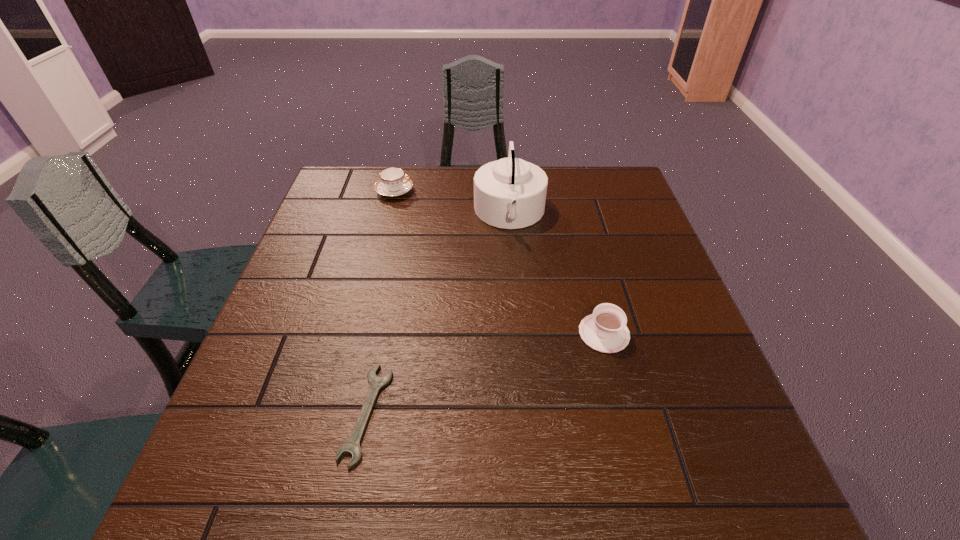
The height and width of the screenshot is (540, 960). I want to click on the tallest object, so click(x=510, y=193).

At what (x,y) coordinates should I click in order to perform the action: click on the third object from left to right. Please return your answer as a coordinate pair (x, y). This screenshot has width=960, height=540. Looking at the image, I should click on (510, 193).

Find the location of a particular element. the left teacup is located at coordinates (393, 182).

The height and width of the screenshot is (540, 960). What are the coordinates of `the right teacup` in the screenshot? It's located at (605, 330).

Where is `the nearer teacup`? Image resolution: width=960 pixels, height=540 pixels. the nearer teacup is located at coordinates (605, 330).

Where is `the shortest object`? the shortest object is located at coordinates (352, 446).

In order to click on the nearest object in this screenshot , I will do `click(352, 446)`.

This screenshot has height=540, width=960. What are the coordinates of `vacant space situated 0.160m on the spout of the second object from right to left` in the screenshot? It's located at (418, 213).

Where is `free spot located on the spout of the second object from right to left`? The height and width of the screenshot is (540, 960). free spot located on the spout of the second object from right to left is located at coordinates (382, 213).

Where is `vacant space positioned on the spout of the second object from right to left`? The image size is (960, 540). vacant space positioned on the spout of the second object from right to left is located at coordinates point(428,213).